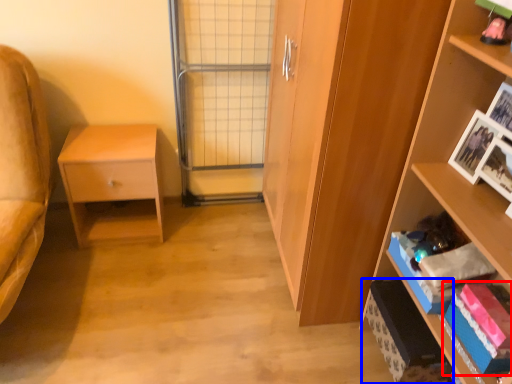
Question: Which point is closer to the camera, book (highlighted by a red box) or cabinet (highlighted by a blue box)?

Choices:
 (A) book
 (B) cabinet

Answer: (A)